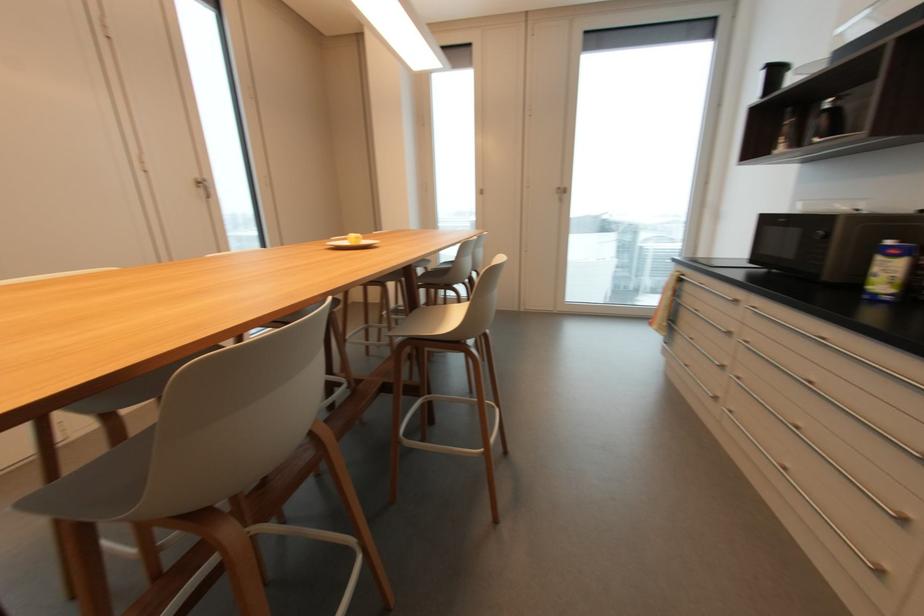
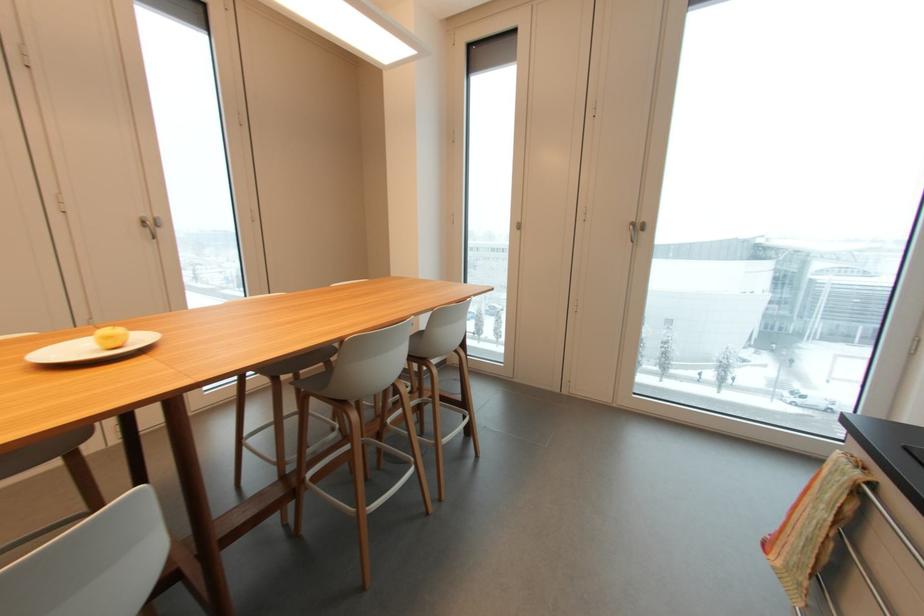
Find the pixel in the second image that matches [359,238] in the first image.

(110, 338)